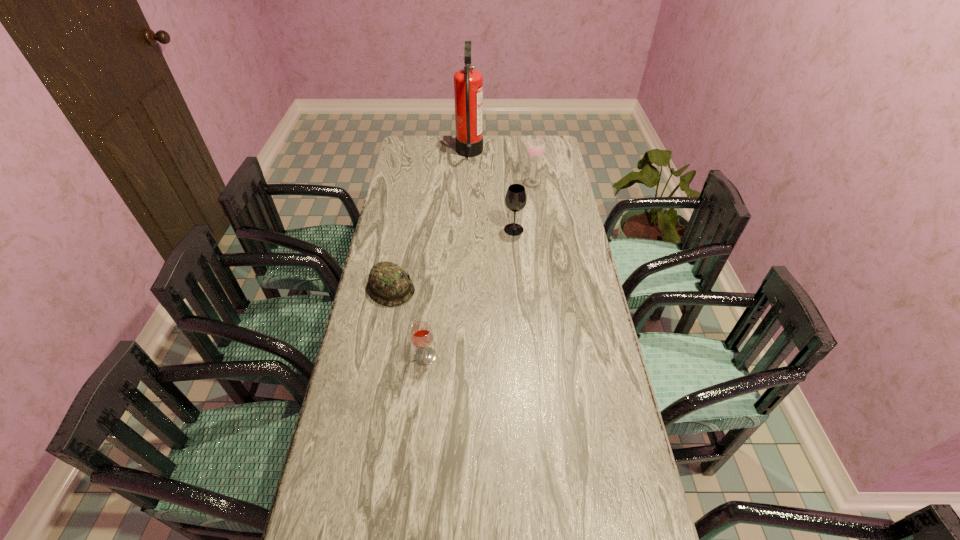
Locate an element on the screen. vacant space in between the third farthest object and the third object from right to left is located at coordinates (492, 192).

Identify the location of the closest object relative to the second object from left to right. (388, 284).

Select which object is the closest to the rightmost wineglass. Please provide its 2D coordinates. Your answer should be formatted as a tuple, i.e. [(x, y)], where the tuple contains the x and y coordinates of a point satisfying the conditions above.

[(468, 83)]

Choose which wineglass is the third nearest neighbor to the third object from right to left. Please provide its 2D coordinates. Your answer should be formatted as a tuple, i.e. [(x, y)], where the tuple contains the x and y coordinates of a point satisfying the conditions above.

[(421, 334)]

Identify the location of wineglass identified as the second closest to the second shortest object. (536, 148).

The width and height of the screenshot is (960, 540). In order to click on free space that satisfies the following two spatial constraints: 1. on the front-facing side of the farthest wineglass; 2. on the right side of the tallest object in this screenshot , I will do `click(468, 182)`.

You are a GUI agent. You are given a task and a screenshot of the screen. Output one action in this format:
    pyautogui.click(x=<x>, y=<y>)
    Task: Click on the free space that satisfies the following two spatial constraints: 1. on the back side of the second nearest object; 2. on the right side of the second object from right to left
    This screenshot has width=960, height=540.
    Given the screenshot: What is the action you would take?
    pyautogui.click(x=402, y=230)

Where is `free space in the image that satisfies the following two spatial constraints: 1. on the front-facing side of the tallest object; 2. on the left side of the second wineglass from right to left`? This screenshot has width=960, height=540. free space in the image that satisfies the following two spatial constraints: 1. on the front-facing side of the tallest object; 2. on the left side of the second wineglass from right to left is located at coordinates (467, 230).

The width and height of the screenshot is (960, 540). Find the location of `free location that satisfies the following two spatial constraints: 1. on the front-facing side of the rightmost object; 2. on the left side of the tallest object`. free location that satisfies the following two spatial constraints: 1. on the front-facing side of the rightmost object; 2. on the left side of the tallest object is located at coordinates (468, 182).

Identify the location of vacant point that satisfies the following two spatial constraints: 1. on the front-facing side of the fire extinguisher; 2. on the back side of the second farthest wineglass. (467, 230).